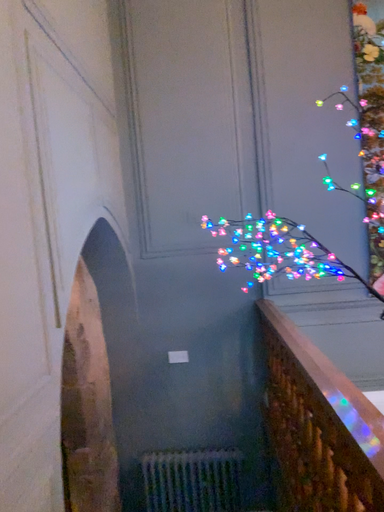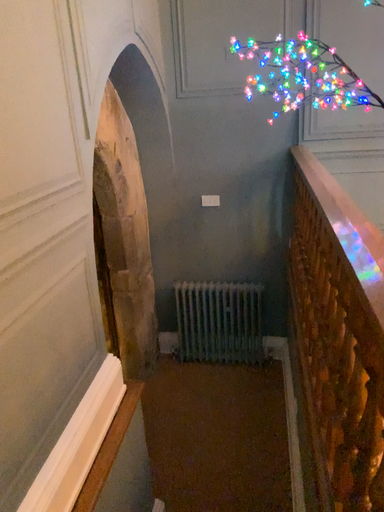
Question: Which way did the camera rotate in the video?

Choices:
 (A) rotated left
 (B) rotated right

Answer: (A)